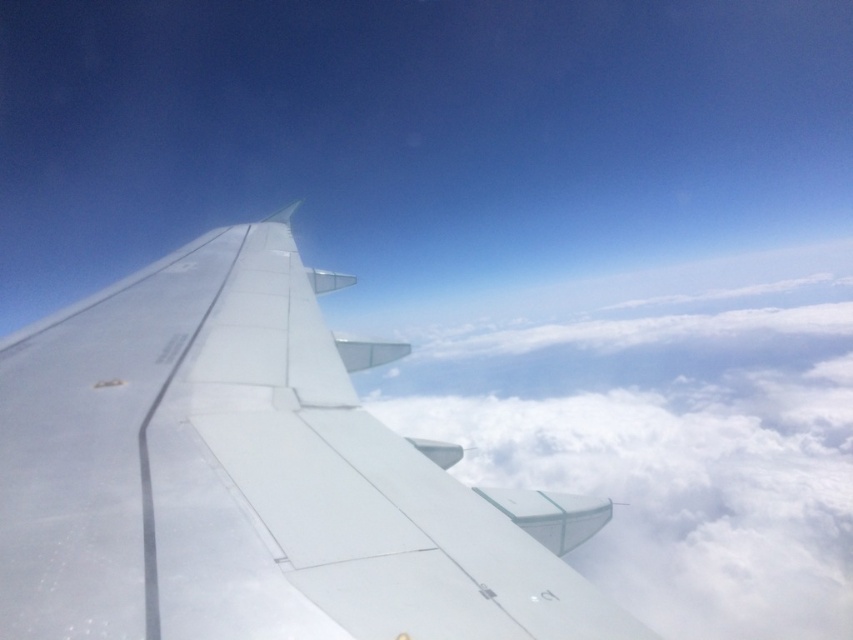
Which is above, white matte airplane wing at upper left or white fluffy cloud at center?

white matte airplane wing at upper left

Between white matte airplane wing at upper left and white fluffy cloud at center, which one has more height?

With more height is white fluffy cloud at center.

Between point (9, 480) and point (556, 451), which one is positioned in front?

Point (9, 480) is in front.

Find the location of a particular element. This screenshot has width=853, height=640. white matte airplane wing at upper left is located at coordinates (253, 477).